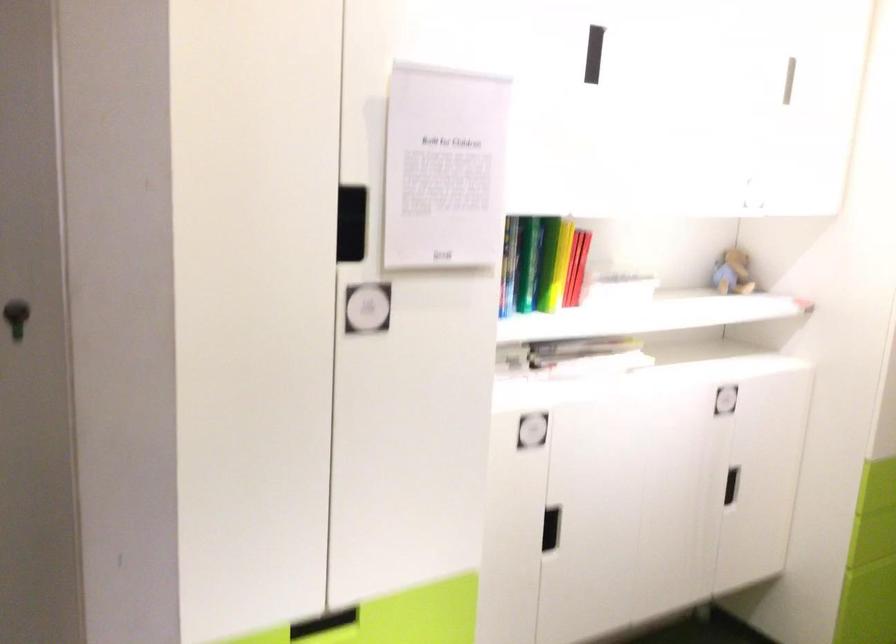
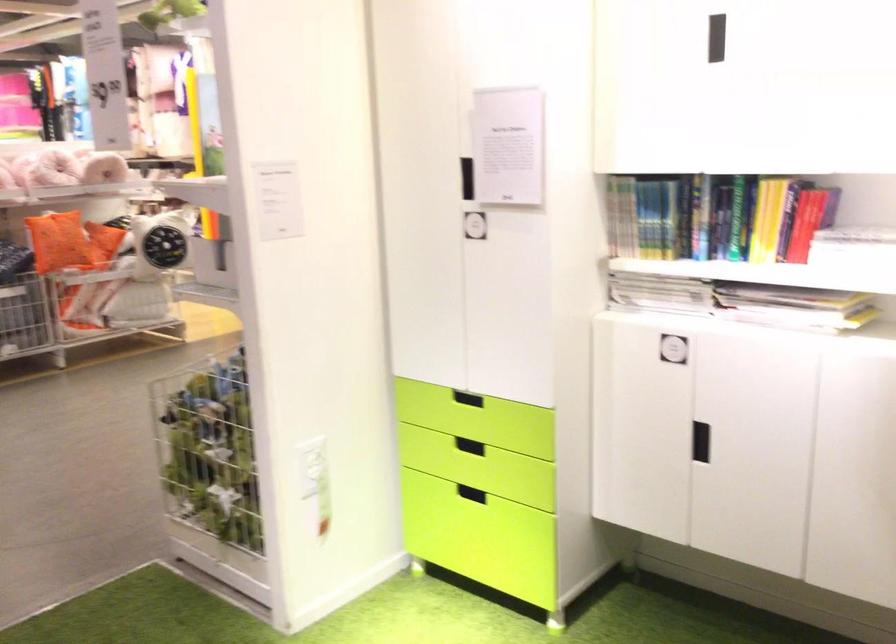
Locate, in the second image, the point that corresponds to [331,238] in the first image.

(467, 178)